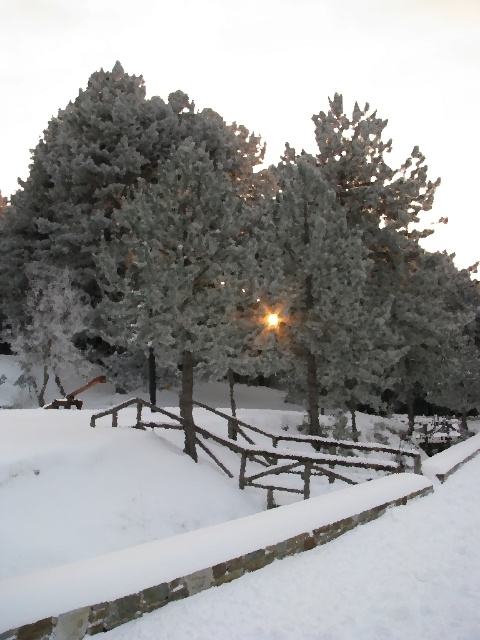
You are standing at the edge of the stone wall near the rustic wooden picnic table. You want to place a small snowman exactly at the center of the white fluffy snow at center. According to the coordinates provided, where should you place the snowman?

The white fluffy snow at center is located at point (229, 541), so you should place the snowman at those coordinates to ensure it is at the center of the white fluffy snow at center.